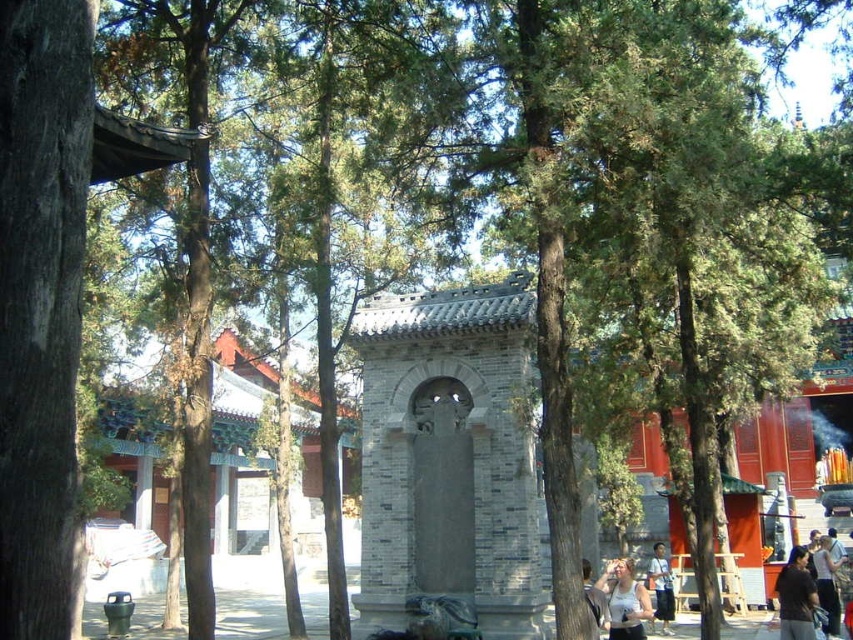
Question: Can you confirm if white cotton shirt at lower right is thinner than light blue shirt at center?

Choices:
 (A) yes
 (B) no

Answer: (B)

Question: Which of the following is the farthest from the observer?

Choices:
 (A) (59, 209)
 (B) (595, 620)

Answer: (B)

Question: Where is light blue shirt at center located in relation to light brown leather jacket at center in the image?

Choices:
 (A) above
 (B) below

Answer: (B)

Question: Which point appears closest to the camera in this image?

Choices:
 (A) (599, 618)
 (B) (782, 605)
 (C) (849, 566)
 (D) (20, 234)

Answer: (D)

Question: Can you confirm if dark brown hair at lower right is smaller than light blue shirt at center?

Choices:
 (A) no
 (B) yes

Answer: (A)

Question: Which of the following is the closest to the observer?

Choices:
 (A) (833, 582)
 (B) (44, 150)

Answer: (B)